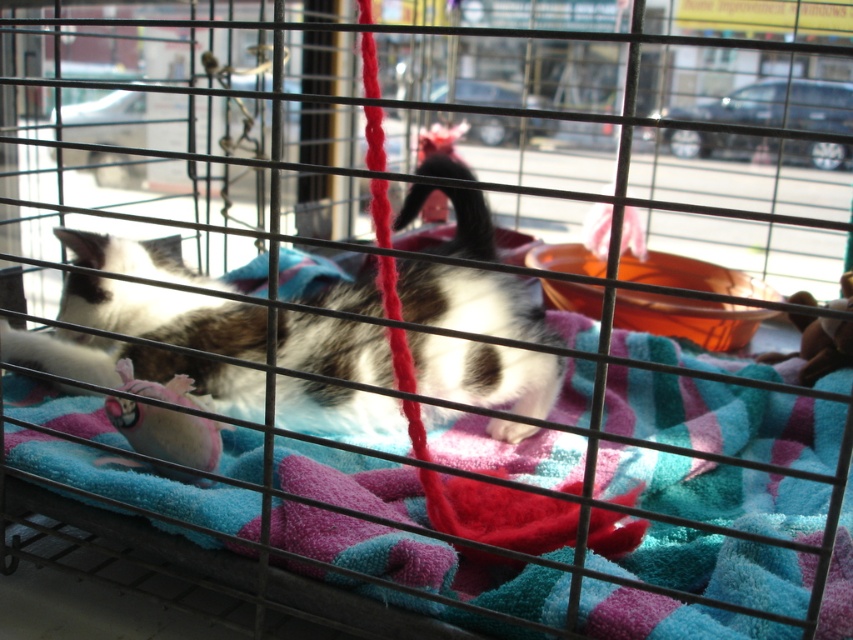
Question: From the image, what is the correct spatial relationship of fluffy white cat at center in relation to rubber duck at center?

Choices:
 (A) above
 (B) below

Answer: (A)

Question: Which object is farther from the camera taking this photo?

Choices:
 (A) pink fabric toy at lower left
 (B) fluffy white cat at center
 (C) rubber duck at center

Answer: (C)

Question: Is pink fabric toy at lower left thinner than rubber duck at center?

Choices:
 (A) yes
 (B) no

Answer: (A)

Question: Which object is closer to the camera taking this photo?

Choices:
 (A) rubber duck at center
 (B) pink fabric toy at lower left

Answer: (B)

Question: Among these objects, which one is farthest from the camera?

Choices:
 (A) rubber duck at center
 (B) pink fabric toy at lower left
 (C) fluffy white cat at center

Answer: (A)

Question: Can you confirm if pink fabric toy at lower left is thinner than rubber duck at center?

Choices:
 (A) yes
 (B) no

Answer: (A)